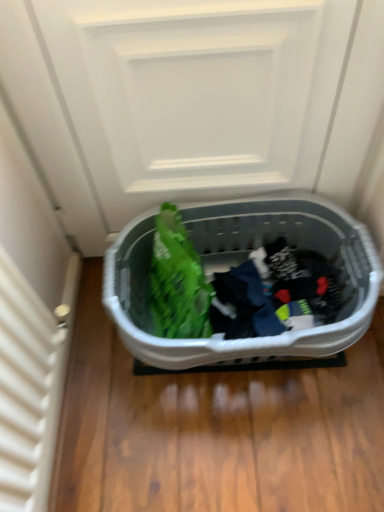
Locate an element on the screen. This screenshot has height=512, width=384. plastic laundry basket at center is located at coordinates (241, 263).

Describe the element at coordinates (241, 263) in the screenshot. I see `plastic laundry basket at center` at that location.

Identify the location of plastic laundry basket at center. (241, 263).